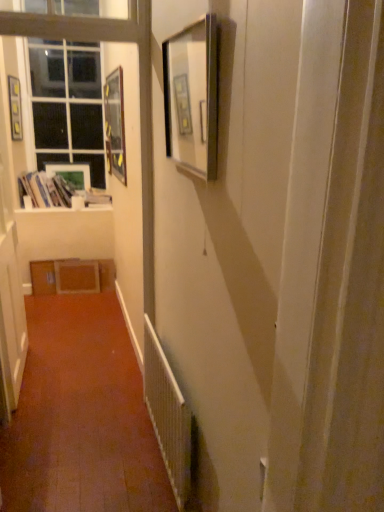
Question: From their relative heights in the image, would you say white glossy window sill at upper left is taller or shorter than white matte door at left?

Choices:
 (A) short
 (B) tall

Answer: (A)

Question: Considering the positions of white glossy window sill at upper left and white matte door at left in the image, is white glossy window sill at upper left bigger or smaller than white matte door at left?

Choices:
 (A) small
 (B) big

Answer: (A)

Question: Which object is positioned closest to the clear glass window at upper left?

Choices:
 (A) matte wooden picture frame at upper left, positioned as the 3th picture frame in back-to-front order
 (B) matte black picture frame at upper center, which is the first picture frame from front to back
 (C) matte wooden picture frame at upper left, the 2th picture frame viewed from the left
 (D) white glossy window sill at upper left
 (E) white textured radiator at lower center

Answer: (A)

Question: Estimate the real-world distances between objects in this image. Which object is closer to the white textured radiator at lower center?

Choices:
 (A) white paper stack at left
 (B) matte wooden picture frame at upper left, the third picture frame positioned from the left
 (C) white glossy window sill at upper left
 (D) clear glass window at upper left
 (E) matte black picture frame at upper left, which ranks as the second picture frame in back-to-front order

Answer: (C)